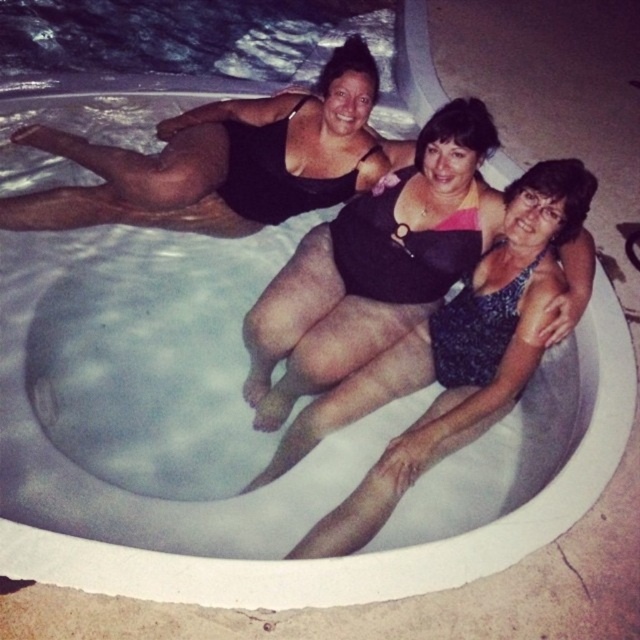
Is black matte swimsuit at center further to the viewer compared to black matte swimsuit at upper center?

That is False.

Is black matte swimsuit at center positioned before black matte swimsuit at upper center?

Yes, it is.

You are a GUI agent. You are given a task and a screenshot of the screen. Output one action in this format:
    pyautogui.click(x=<x>, y=<y>)
    Task: Click on the black matte swimsuit at center
    The height and width of the screenshot is (640, 640).
    Given the screenshot: What is the action you would take?
    (374, 266)